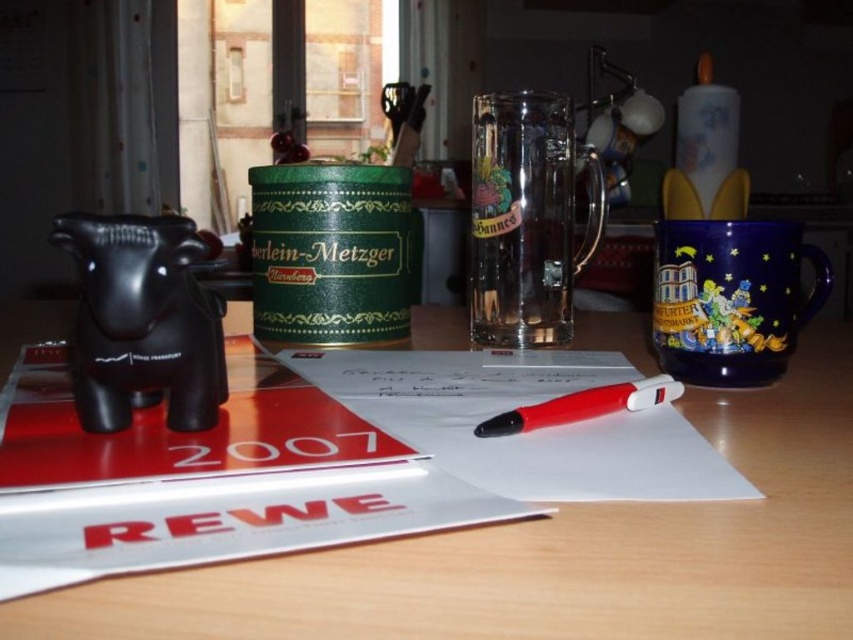
Question: Estimate the real-world distances between objects in this image. Which object is closer to the transparent glass mug at center?

Choices:
 (A) white paper at center
 (B) blue ceramic mug at right
 (C) wooden table at center

Answer: (B)

Question: Is black rubber elephant at left closer to the viewer compared to blue ceramic mug at right?

Choices:
 (A) yes
 (B) no

Answer: (A)

Question: Which point is farther to the camera?

Choices:
 (A) transparent glass mug at center
 (B) white paper at center
 (C) black rubber elephant at left
 (D) wooden table at center

Answer: (A)

Question: Among these objects, which one is nearest to the camera?

Choices:
 (A) wooden table at center
 (B) white paper at center
 (C) black rubber elephant at left
 (D) blue ceramic mug at right

Answer: (A)

Question: Does white paper at center appear on the right side of blue ceramic mug at right?

Choices:
 (A) yes
 (B) no

Answer: (B)

Question: Can you confirm if white paper at center is positioned below transparent glass mug at center?

Choices:
 (A) yes
 (B) no

Answer: (A)